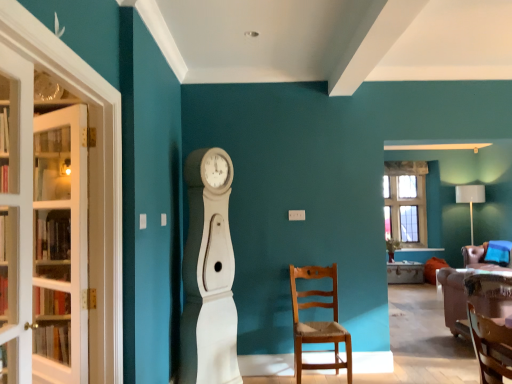
Question: Do you think wooden chair at center, which is the first chair from left to right, is within white glass door at left, placed as the first door when sorted from front to back, or outside of it?

Choices:
 (A) outside
 (B) inside

Answer: (A)

Question: Is wooden chair at center, the 2th chair viewed from the right, wider or thinner than white glass door at left, placed as the first door when sorted from front to back?

Choices:
 (A) thin
 (B) wide

Answer: (B)

Question: Considering the real-world distances, which object is closest to the white glass door at left, acting as the second door starting from the left?

Choices:
 (A) clear glass window at upper right
 (B) wooden chair at center, positioned as the 2th chair in back-to-front order
 (C) wooden table at center
 (D) clear glass cabinet at left
 (E) white glass door at left, which is the first door from left to right

Answer: (D)

Question: Estimate the real-world distances between objects in this image. Which object is farther from the clear glass window at upper right?

Choices:
 (A) wooden chair at center, acting as the first chair starting from the front
 (B) white wood clock at center
 (C) clear glass cabinet at left
 (D) wooden chair at center, the second chair viewed from the front
 (E) velvet brown sofa at lower right

Answer: (C)